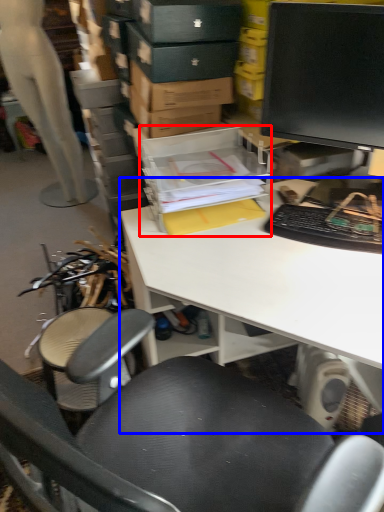
Question: Which object appears closest to the camera in this image, storage box (highlighted by a red box) or desk (highlighted by a blue box)?

Choices:
 (A) storage box
 (B) desk

Answer: (B)